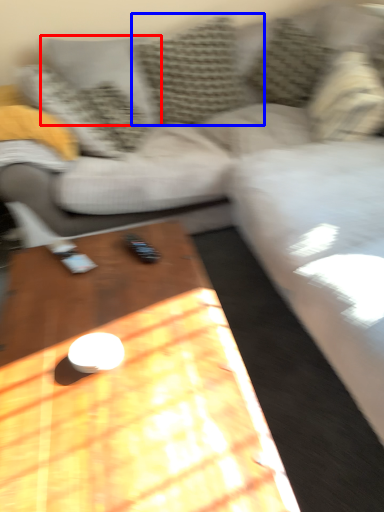
Question: Which object is further to the camera taking this photo, pillow (highlighted by a red box) or pillow (highlighted by a blue box)?

Choices:
 (A) pillow
 (B) pillow

Answer: (A)